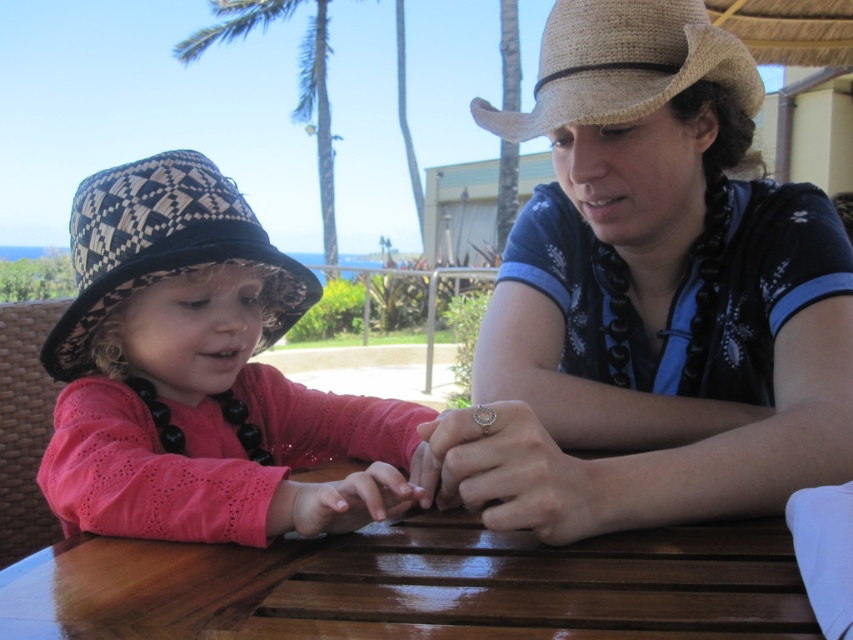
You are designing a tablecloth for the shiny brown wood table at center. The tablecloth needs to hang down to the floor. Considering the height of the table, would the black and white woven straw hat at left be an issue when placing the tablecloth?

The shiny brown wood table at center is not as tall as the black and white woven straw hat at left. Therefore, the tablecloth might hit the hat when placed, so you need to adjust the tablecloth length or move the hat to avoid obstruction.

You are standing in front of the scene and want to touch both points. Which point should you reach for first, point (317, 429) or point (599, 67)?

You should reach for point (317, 429) first because it is closer to you than point (599, 67).

You are a fashion designer observing the hats in the image. Which hat is taller between the black and white woven straw hat at left and the woven straw cowboy hat at upper right?

The black and white woven straw hat at left is taller than the woven straw cowboy hat at upper right according to the description.